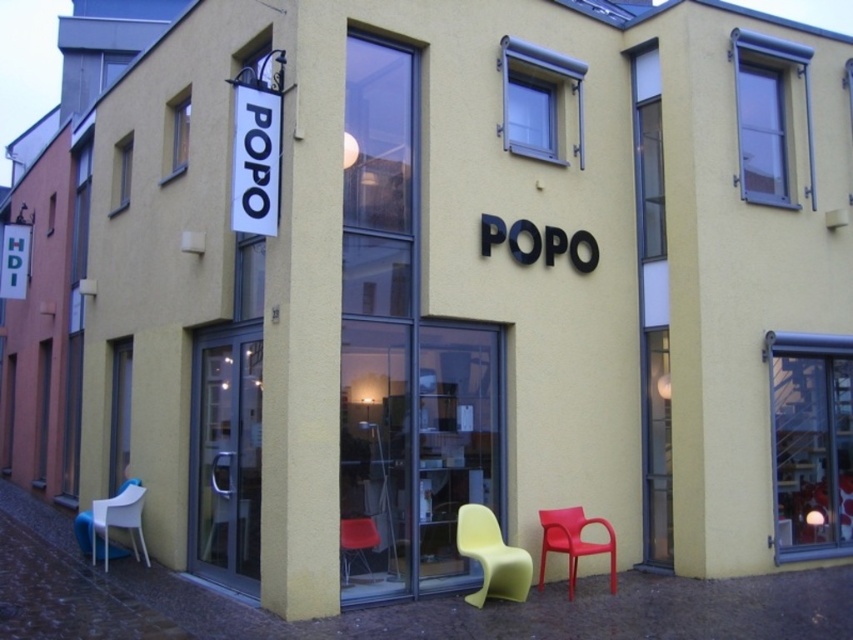
Question: Which of these objects is positioned farthest from the white plastic chair at lower left?

Choices:
 (A) matte plastic chair at lower right
 (B) matte orange chair at center

Answer: (A)

Question: Where is white plastic chair at lower left located in relation to matte plastic chair at lower right in the image?

Choices:
 (A) below
 (B) above

Answer: (B)

Question: From the image, what is the correct spatial relationship of white plastic chair at lower left in relation to matte orange chair at center?

Choices:
 (A) below
 (B) above

Answer: (A)

Question: Which point appears farthest from the camera in this image?

Choices:
 (A) (498, 529)
 (B) (123, 497)
 (C) (363, 536)
 (D) (556, 545)

Answer: (B)

Question: Does matte yellow plastic chair at lower center have a larger size compared to matte plastic chair at lower right?

Choices:
 (A) yes
 (B) no

Answer: (B)

Question: Which of the following is the farthest from the observer?

Choices:
 (A) (361, 540)
 (B) (88, 536)
 (C) (573, 531)
 (D) (509, 570)

Answer: (B)